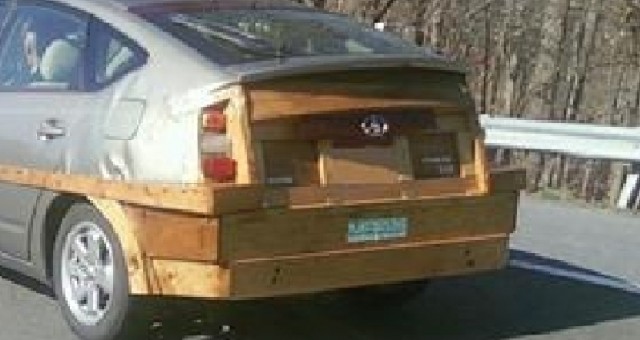
Where is `door handle`? The image size is (640, 340). door handle is located at coordinates (52, 131).